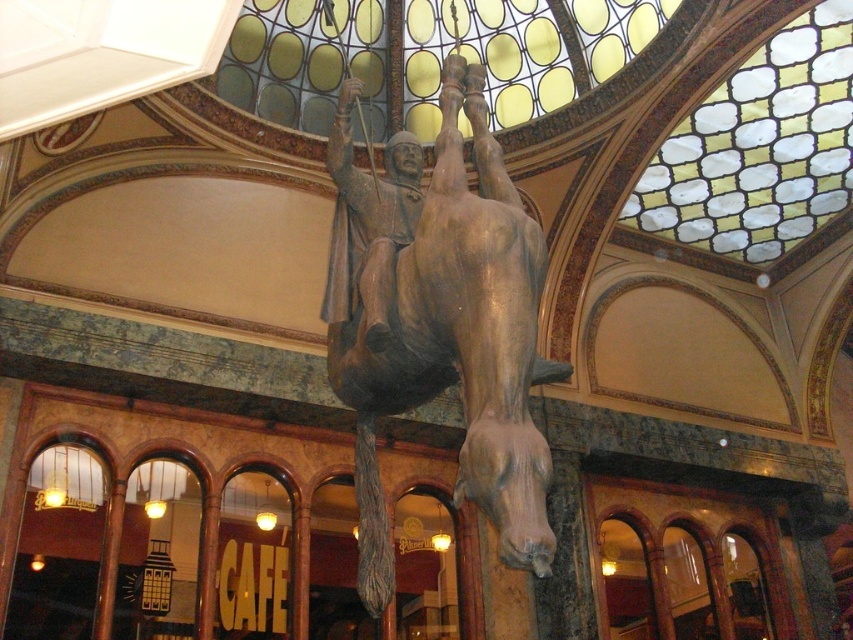
Question: Which is farther from the stained glass mosaic at upper center?

Choices:
 (A) stained glass window at upper center
 (B) wooden statue at center
 (C) bronze statue at center

Answer: (C)

Question: Is stained glass window at upper center to the left of wooden statue at center from the viewer's perspective?

Choices:
 (A) yes
 (B) no

Answer: (B)

Question: Where is stained glass mosaic at upper center located in relation to wooden statue at center in the image?

Choices:
 (A) right
 (B) left

Answer: (A)

Question: Which point appears farthest from the camera in this image?

Choices:
 (A) (776, 92)
 (B) (596, 109)
 (C) (492, 232)
 (D) (329, 312)

Answer: (B)

Question: Observing the image, what is the correct spatial positioning of stained glass mosaic at upper center in reference to wooden statue at center?

Choices:
 (A) above
 (B) below

Answer: (A)

Question: Which point is closer to the camera?

Choices:
 (A) (491, 312)
 (B) (370, 33)

Answer: (A)